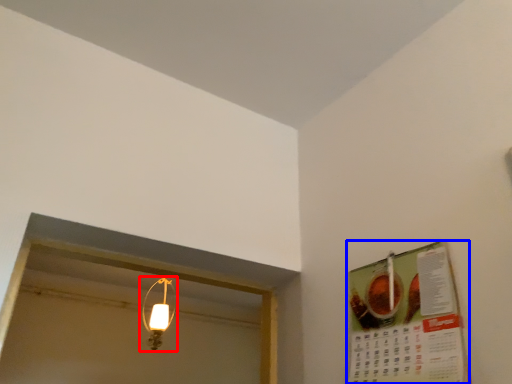
Question: Which point is closer to the camera, lamp (highlighted by a red box) or menu (highlighted by a blue box)?

Choices:
 (A) lamp
 (B) menu

Answer: (B)